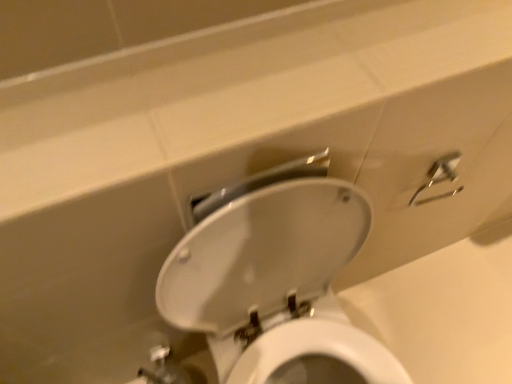
The width and height of the screenshot is (512, 384). Describe the element at coordinates (276, 286) in the screenshot. I see `white glossy toilet at center` at that location.

The width and height of the screenshot is (512, 384). Identify the location of white glossy toilet at center. (276, 286).

Measure the distance between white glossy toilet at center and camera.

white glossy toilet at center and camera are 57.25 centimeters apart from each other.

This screenshot has height=384, width=512. Identify the location of white glossy toilet at center. (276, 286).